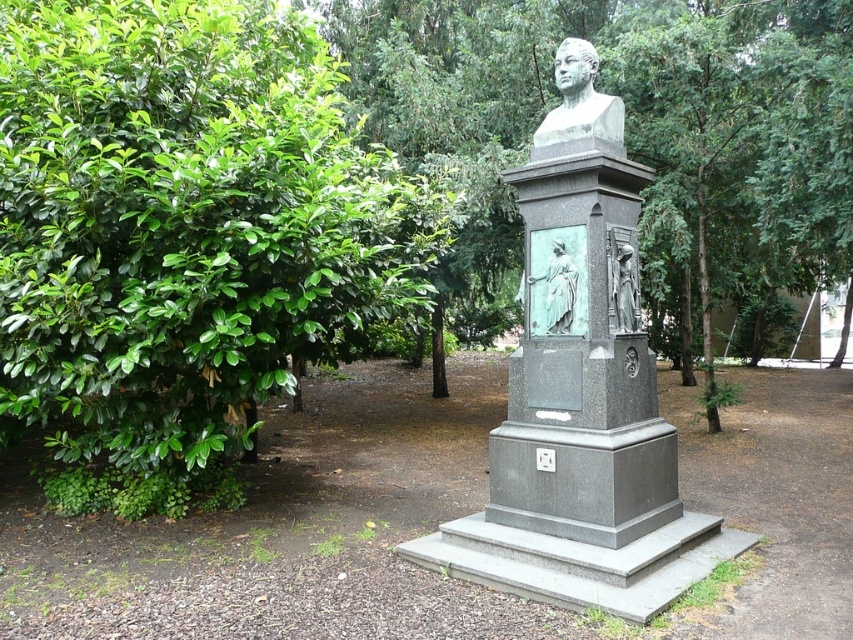
The image size is (853, 640). Describe the element at coordinates (579, 99) in the screenshot. I see `bronze bust at center` at that location.

Does bronze bust at center have a smaller size compared to bronze relief figure at center?

Incorrect, bronze bust at center is not smaller in size than bronze relief figure at center.

What do you see at coordinates (579, 99) in the screenshot? I see `bronze bust at center` at bounding box center [579, 99].

The image size is (853, 640). I want to click on bronze bust at center, so click(579, 99).

Between green leafy bush at left and green patina statue at center, which one has more height?

Standing taller between the two is green leafy bush at left.

Is green leafy bush at left to the left of green patina statue at center from the viewer's perspective?

Indeed, green leafy bush at left is positioned on the left side of green patina statue at center.

Locate an element on the screen. The width and height of the screenshot is (853, 640). green leafy bush at left is located at coordinates (183, 221).

Where is `green leafy bush at left`? Image resolution: width=853 pixels, height=640 pixels. green leafy bush at left is located at coordinates (183, 221).

Does green patina stone bust at center have a lesser height compared to bronze bust at center?

Incorrect, green patina stone bust at center's height does not fall short of bronze bust at center's.

Can you confirm if green patina stone bust at center is wider than bronze bust at center?

Indeed, green patina stone bust at center has a greater width compared to bronze bust at center.

Is point (583, 144) closer to viewer compared to point (579, 93)?

That is True.

Image resolution: width=853 pixels, height=640 pixels. Find the location of `green patina stone bust at center`. green patina stone bust at center is located at coordinates (579, 339).